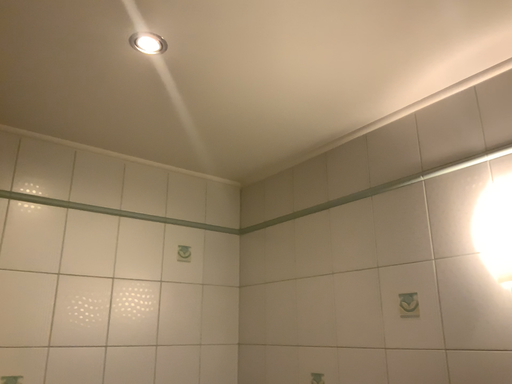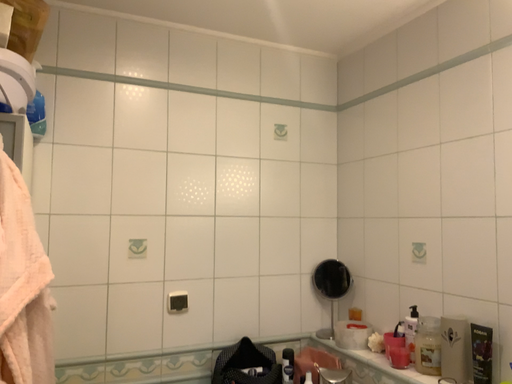
Question: Which way did the camera rotate in the video?

Choices:
 (A) rotated downward
 (B) rotated upward

Answer: (A)